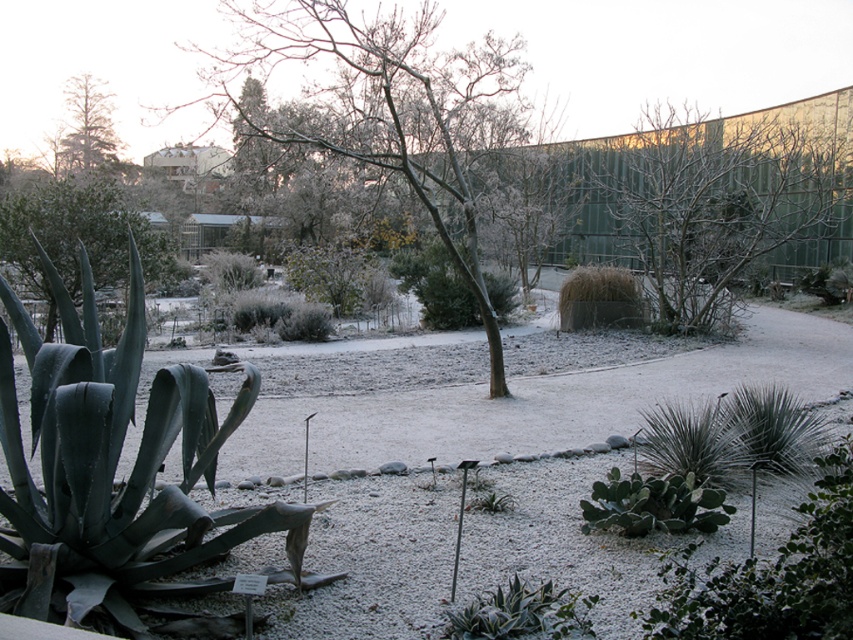
You are standing at the entrance of the botanical garden and see two points marked in the image. The first point is at coordinate point (242, 28) and the second is at point (782, 166). Which point is closer to you?

Point (242, 28) is further to the camera than point (782, 166), so the second point is closer to you.

You are a gardener who needs to prune the frosted bark tree at center and the green matte tree at upper left. Given their sizes, which tree will require more time and effort to prune?

The frosted bark tree at center has a larger size compared to the green matte tree at upper left, so it will require more time and effort to prune.